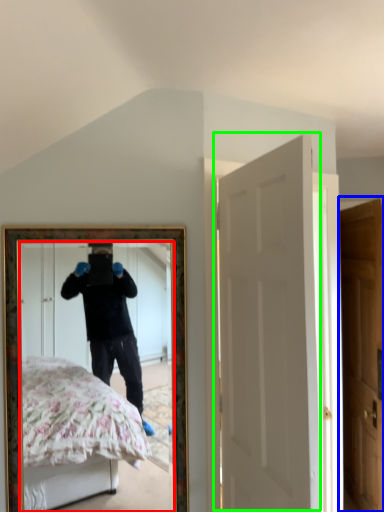
Question: Which object is the closest to the mirror (highlighted by a red box)? Choose among these: door (highlighted by a blue box) or door (highlighted by a green box).

Choices:
 (A) door
 (B) door

Answer: (A)